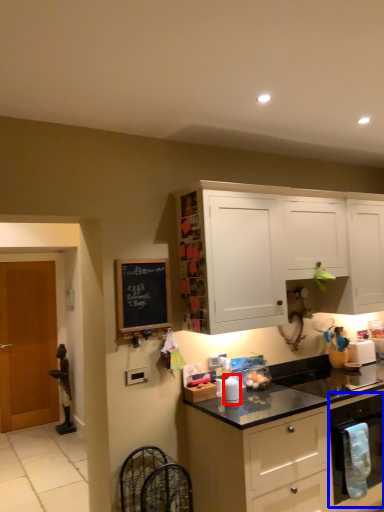
Question: Among these objects, which one is nearest to the camera, appliance (highlighted by a red box) or kitchen appliance (highlighted by a blue box)?

Choices:
 (A) appliance
 (B) kitchen appliance

Answer: (A)